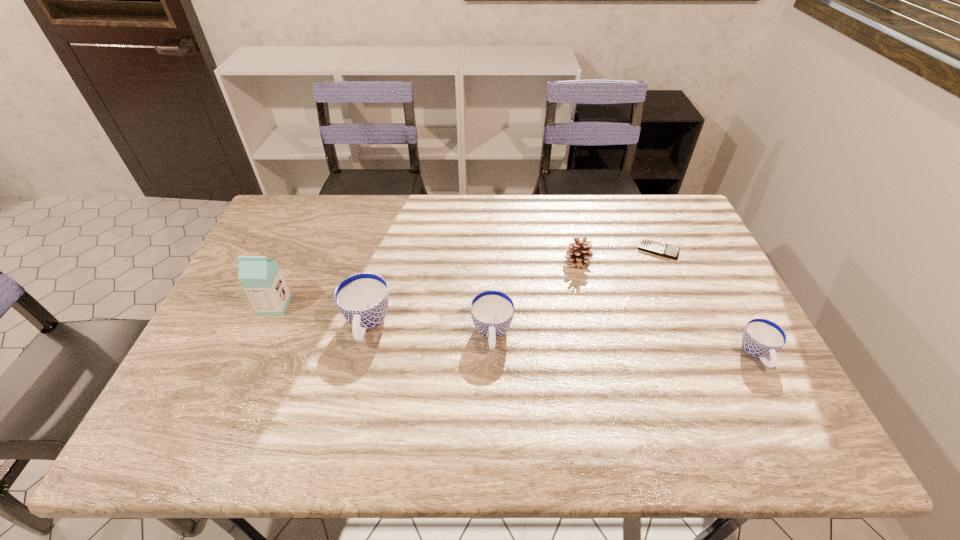
Image resolution: width=960 pixels, height=540 pixels. I want to click on vacant area at the near edge, so click(x=510, y=376).

Where is `vacant space at the left edge of the desktop`? Image resolution: width=960 pixels, height=540 pixels. vacant space at the left edge of the desktop is located at coordinates (291, 254).

The height and width of the screenshot is (540, 960). I want to click on vacant region at the right edge of the desktop, so click(725, 329).

Where is `free region at the far right corner of the desktop`? free region at the far right corner of the desktop is located at coordinates (672, 220).

Where is `vacant space that's between the rightmost object and the fourth object from right to left`? This screenshot has height=540, width=960. vacant space that's between the rightmost object and the fourth object from right to left is located at coordinates (624, 344).

Identify the location of vacant space in between the leftmost cup and the pinecone. pyautogui.click(x=472, y=293).

Locate an element on the screen. This screenshot has width=960, height=540. empty space that is in between the rightmost object and the shortest object is located at coordinates (708, 302).

In order to click on vacant space in between the fifth tallest object and the pinecone in this screenshot , I will do `click(667, 308)`.

This screenshot has width=960, height=540. I want to click on free spot between the shortest object and the rightmost object, so click(x=708, y=302).

Locate an element on the screen. free point between the leftmost object and the calculator is located at coordinates (467, 278).